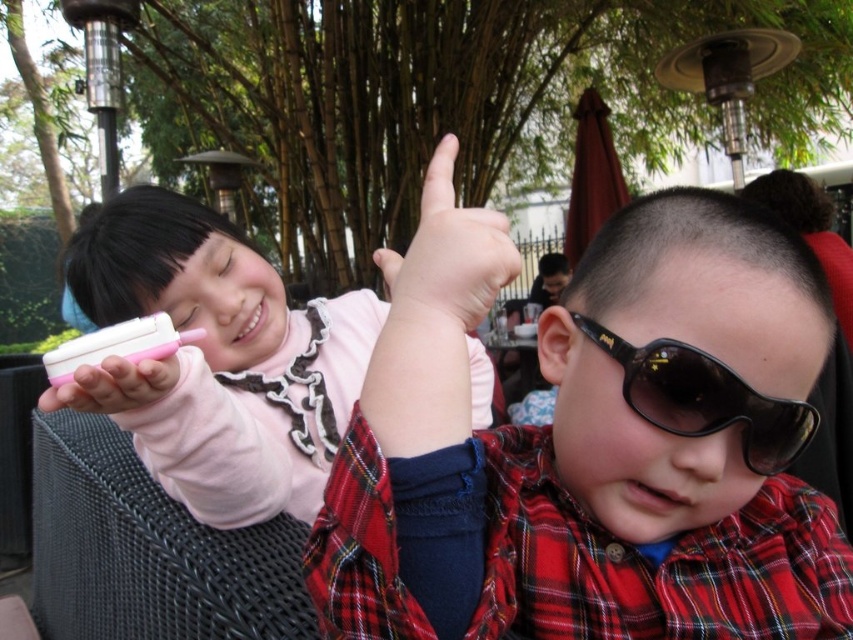
You are a parent trying to pack a lunchbox for your child. The lunchbox has a height limit of 10 cm. You have both the black plastic goggles at center and the pink matte ice cream at center. Based on their sizes, which item can fit into the lunchbox?

The pink matte ice cream at center is shorter than the black plastic goggles at center, so the pink matte ice cream at center can fit into the lunchbox as it is under the 10 cm height limit.

You are a photographer trying to capture the perfect shot of the black plastic goggles at center. The children are moving around, but you know their positions relative to the goggles. Where should you aim your camera to ensure the goggles are in the frame?

You should aim your camera at the coordinates point (704, 397) where the black plastic goggles at center are located.